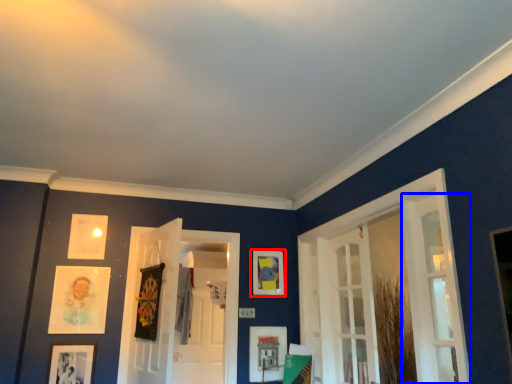
Question: Among these objects, which one is farthest to the camera, picture frame (highlighted by a red box) or door (highlighted by a blue box)?

Choices:
 (A) picture frame
 (B) door

Answer: (A)